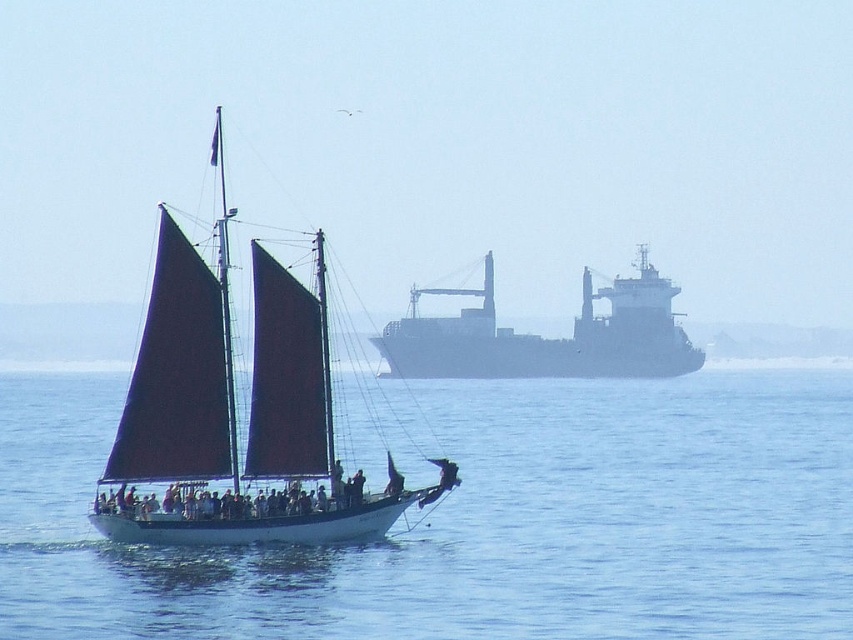
Question: Estimate the real-world distances between objects in this image. Which object is farther from the white matte sailboat at center?

Choices:
 (A) white smooth water at center
 (B) matte red sails at center

Answer: (A)

Question: Can you confirm if matte red sails at center is positioned to the left of dark gray metallic cargo ship at upper center?

Choices:
 (A) yes
 (B) no

Answer: (A)

Question: Which of these objects is positioned closest to the dark gray metallic cargo ship at upper center?

Choices:
 (A) matte red sails at center
 (B) white matte sailboat at center

Answer: (A)

Question: Is white smooth water at center to the right of dark gray metallic cargo ship at upper center from the viewer's perspective?

Choices:
 (A) no
 (B) yes

Answer: (B)

Question: Which object is positioned closest to the dark gray metallic cargo ship at upper center?

Choices:
 (A) white matte sailboat at center
 (B) matte red sails at center
 (C) white smooth water at center

Answer: (C)

Question: Is matte red sails at center wider than dark gray metallic cargo ship at upper center?

Choices:
 (A) no
 (B) yes

Answer: (B)